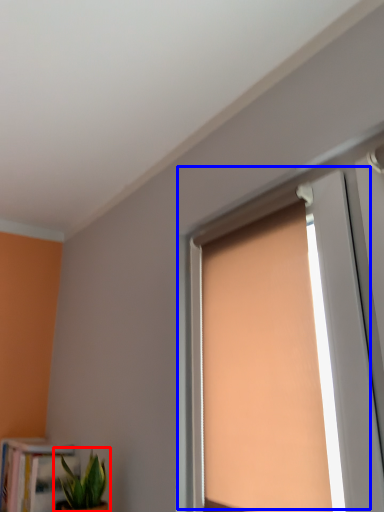
Question: Which point is closer to the camera, houseplant (highlighted by a red box) or window (highlighted by a blue box)?

Choices:
 (A) houseplant
 (B) window

Answer: (B)